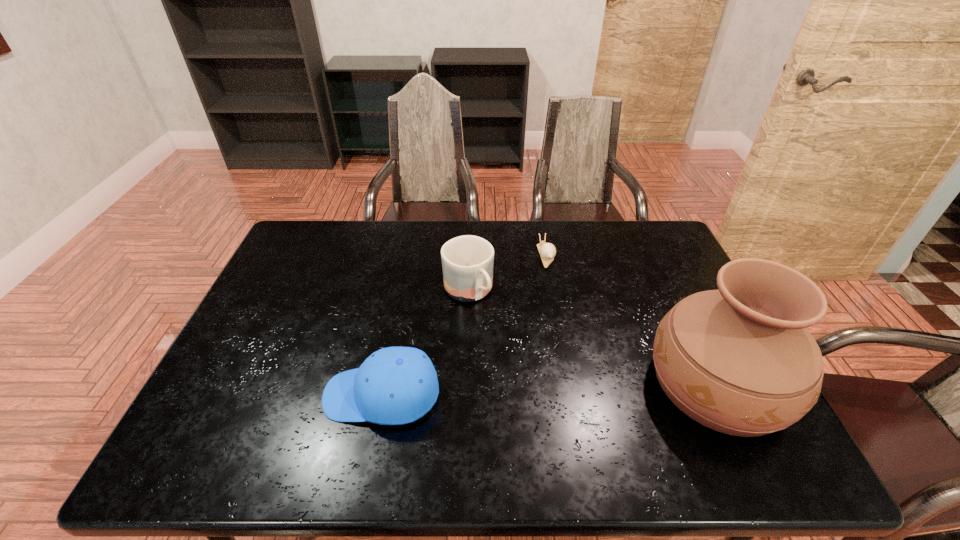
At what (x,y) coordinates should I click in order to perform the action: click on cap. Please return your answer as a coordinate pair (x, y). This screenshot has height=540, width=960. Looking at the image, I should click on (395, 385).

Where is `the tallest object`? The height and width of the screenshot is (540, 960). the tallest object is located at coordinates (739, 360).

Where is `urn`? The width and height of the screenshot is (960, 540). urn is located at coordinates (739, 360).

Image resolution: width=960 pixels, height=540 pixels. Find the location of `mug`. mug is located at coordinates (467, 261).

At what (x,y) coordinates should I click in order to perform the action: click on the third object from left to right. Please return your answer as a coordinate pair (x, y). This screenshot has height=540, width=960. Looking at the image, I should click on (547, 251).

Image resolution: width=960 pixels, height=540 pixels. I want to click on escargot, so (x=547, y=251).

Identify the location of vacant area located on the front-facing side of the cap. The width and height of the screenshot is (960, 540). (229, 395).

Identify the location of vacant region located 0.200m on the front-facing side of the cap. The height and width of the screenshot is (540, 960). click(x=242, y=395).

Locate an element on the screen. vacant space located on the front-facing side of the cap is located at coordinates (254, 395).

At what (x,y) coordinates should I click in order to perform the action: click on free point located 0.100m on the left of the rightmost object. Please return your answer as a coordinate pair (x, y). This screenshot has height=540, width=960. Looking at the image, I should click on (607, 384).